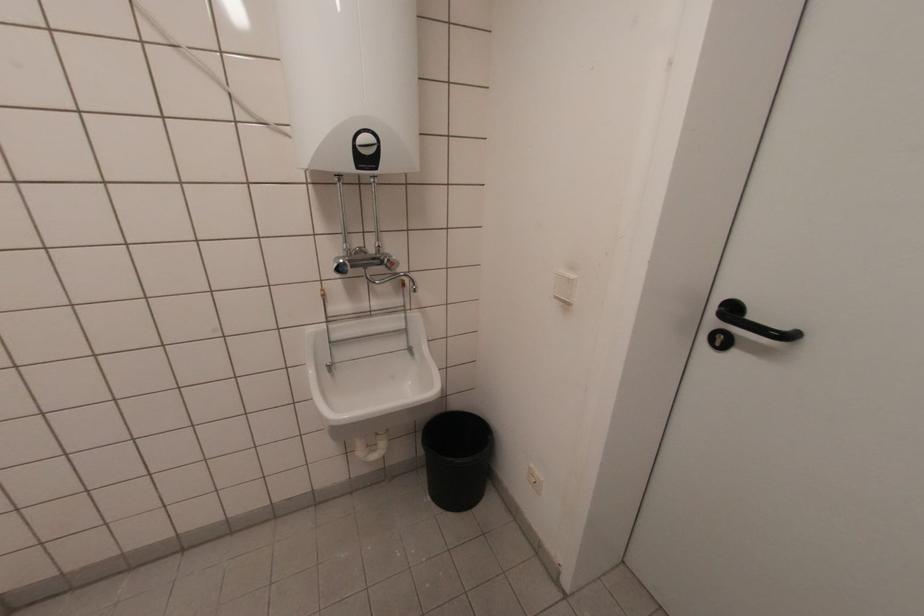
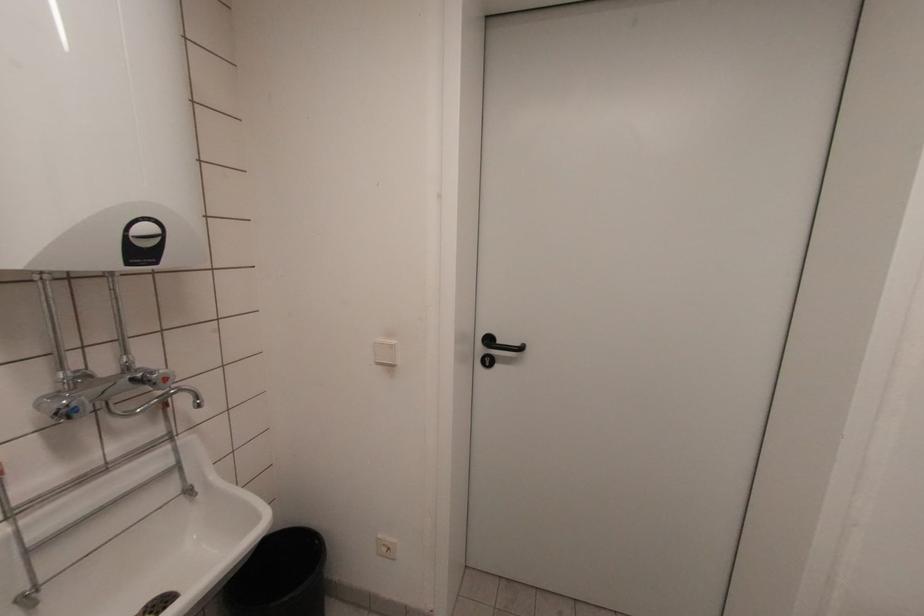
In the second image, find the point that corresponds to pixel 371 167 in the first image.

(151, 261)